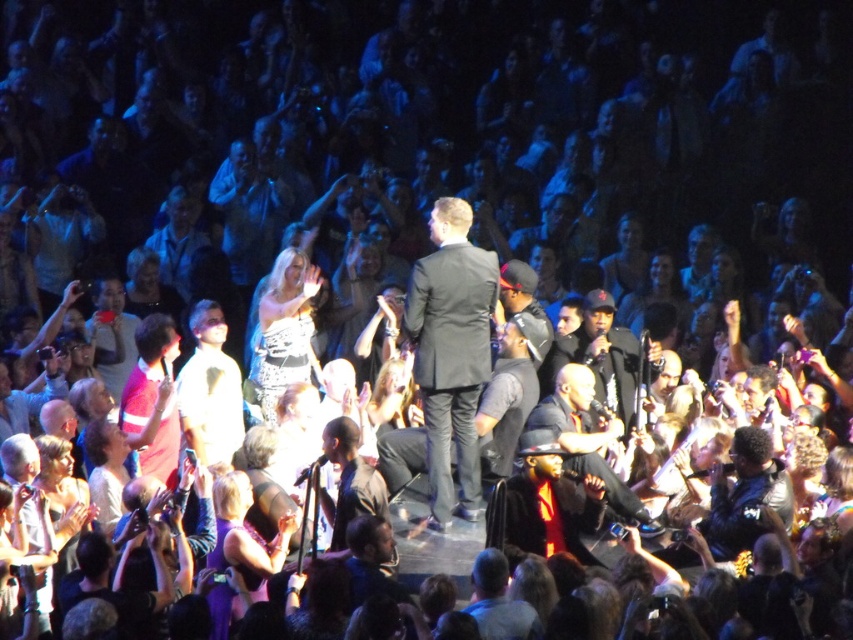
Question: Can you confirm if matte black suit at center is positioned to the right of dark gray leather jacket at center?

Choices:
 (A) yes
 (B) no

Answer: (B)

Question: Which of the following is the farthest from the observer?

Choices:
 (A) (408, 332)
 (B) (593, 387)

Answer: (B)

Question: Can you confirm if matte black suit at center is wider than dark gray leather jacket at center?

Choices:
 (A) no
 (B) yes

Answer: (A)

Question: Does matte black suit at center have a lesser width compared to dark gray leather jacket at center?

Choices:
 (A) no
 (B) yes

Answer: (B)